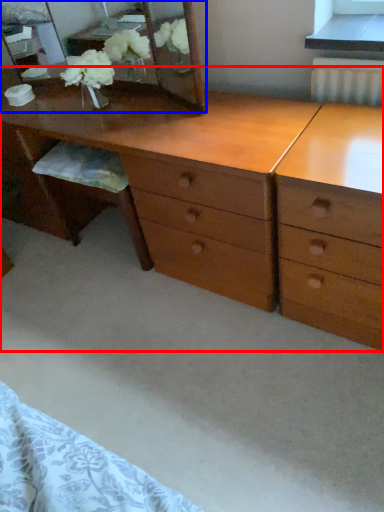
Question: Which of the following is the farthest to the observer, desk (highlighted by a red box) or mirror (highlighted by a blue box)?

Choices:
 (A) desk
 (B) mirror

Answer: (B)